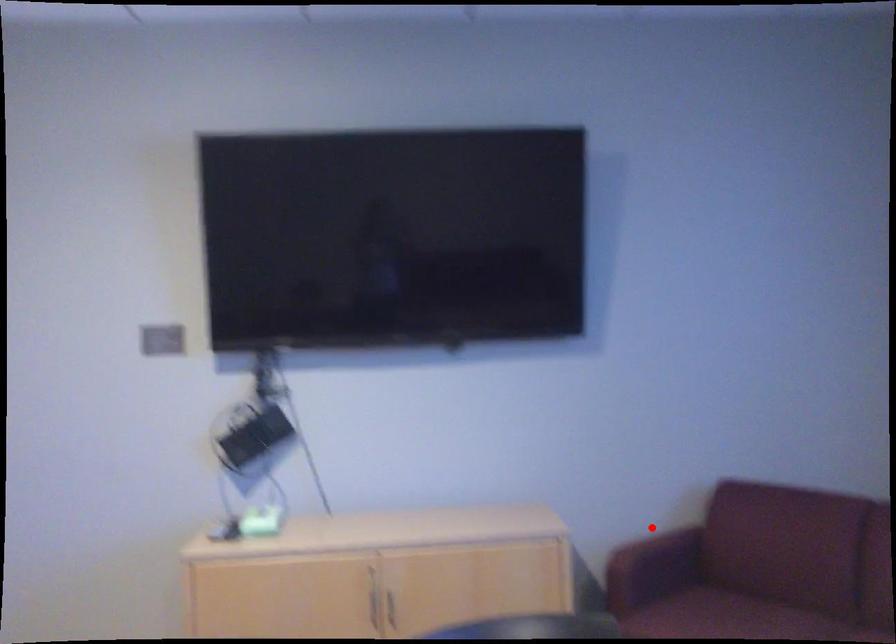
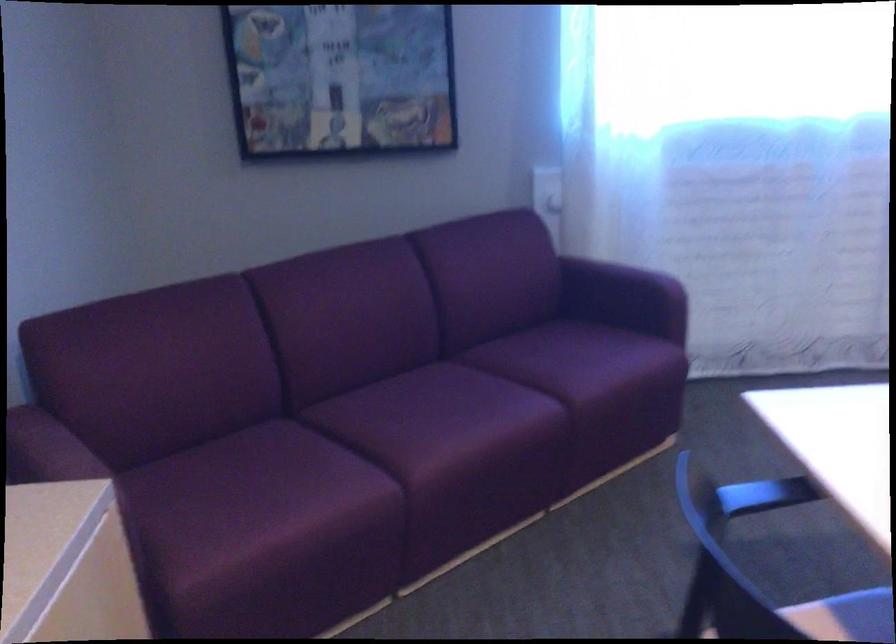
Locate, in the second image, the point that corresponds to the highlighted location in the first image.

(33, 446)